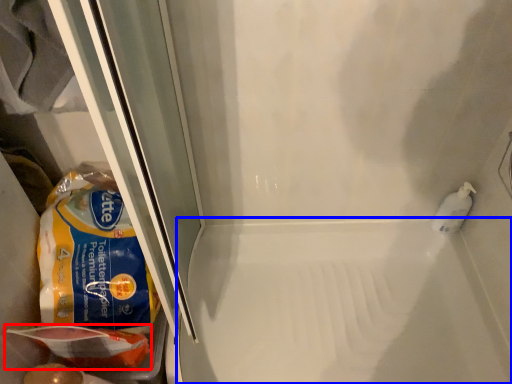
Question: Which of the following is the closest to the observer, food (highlighted by a red box) or bath (highlighted by a blue box)?

Choices:
 (A) food
 (B) bath

Answer: (A)